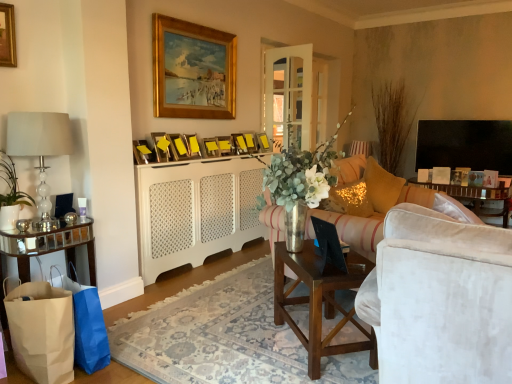
Question: Is the position of clear glass lamp at left, the 2th lamp viewed from the right, more distant than that of yellow matte picture frame at center, marked as the eighth picture frame in a left-to-right arrangement?

Choices:
 (A) no
 (B) yes

Answer: (A)

Question: Considering the relative sizes of clear glass lamp at left, the first lamp when ordered from bottom to top, and yellow matte picture frame at center, marked as the eighth picture frame in a left-to-right arrangement, in the image provided, is clear glass lamp at left, the first lamp when ordered from bottom to top, bigger than yellow matte picture frame at center, marked as the eighth picture frame in a left-to-right arrangement,?

Choices:
 (A) yes
 (B) no

Answer: (A)

Question: From the image's perspective, would you say clear glass lamp at left, the 2th lamp viewed from the right, is shown under yellow matte picture frame at center, marked as the eighth picture frame in a left-to-right arrangement?

Choices:
 (A) no
 (B) yes

Answer: (B)

Question: Is clear glass lamp at left, the 2th lamp viewed from the right, at the right side of yellow matte picture frame at center, which ranks as the 4th picture frame in right-to-left order?

Choices:
 (A) yes
 (B) no

Answer: (B)

Question: Would you say clear glass lamp at left, the first lamp positioned from the front, is a long distance from yellow matte picture frame at center, marked as the eighth picture frame in a left-to-right arrangement?

Choices:
 (A) yes
 (B) no

Answer: (A)

Question: Is sparkly gold pillow at right, arranged as the 1th pillow when viewed from the front, situated inside white ceramic vase at left or outside?

Choices:
 (A) inside
 (B) outside

Answer: (B)

Question: Is sparkly gold pillow at right, arranged as the 1th pillow when viewed from the front, bigger or smaller than white ceramic vase at left?

Choices:
 (A) big
 (B) small

Answer: (A)

Question: Considering their positions, is sparkly gold pillow at right, the second pillow viewed from the back, located in front of or behind white ceramic vase at left?

Choices:
 (A) behind
 (B) front

Answer: (A)

Question: From the image's perspective, is sparkly gold pillow at right, the second pillow viewed from the back, positioned above or below white ceramic vase at left?

Choices:
 (A) above
 (B) below

Answer: (B)

Question: Is brown paper bag at lower left, which is counted as the 1th shopping bag, starting from the front, in front of or behind yellow paper picture frame at center, which is counted as the 1th picture frame, starting from the right, in the image?

Choices:
 (A) front
 (B) behind

Answer: (A)

Question: Would you say brown paper bag at lower left, positioned as the second shopping bag in back-to-front order, is inside or outside yellow paper picture frame at center, which is counted as the 1th picture frame, starting from the right?

Choices:
 (A) outside
 (B) inside

Answer: (A)

Question: Is brown paper bag at lower left, positioned as the second shopping bag in back-to-front order, taller or shorter than yellow paper picture frame at center, acting as the 11th picture frame starting from the left?

Choices:
 (A) tall
 (B) short

Answer: (A)

Question: Is brown paper bag at lower left, which is counted as the 1th shopping bag, starting from the front, to the left or to the right of yellow paper picture frame at center, which is counted as the 1th picture frame, starting from the right, in the image?

Choices:
 (A) right
 (B) left

Answer: (B)

Question: Does point (20, 249) appear closer or farther from the camera than point (141, 160)?

Choices:
 (A) farther
 (B) closer

Answer: (B)

Question: Based on their positions, is mirrored glass table at lower left, the 2th table in the right-to-left sequence, located to the left or right of yellow paper picture frame at upper center, acting as the 10th picture frame starting from the right?

Choices:
 (A) left
 (B) right

Answer: (A)